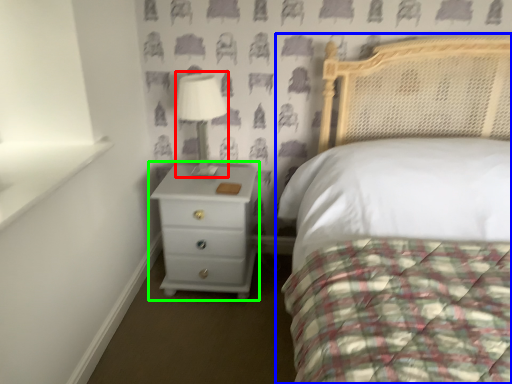
Question: Which is nearer to the table lamp (highlighted by a red box)? bed (highlighted by a blue box) or chest of drawers (highlighted by a green box).

Choices:
 (A) bed
 (B) chest of drawers

Answer: (B)